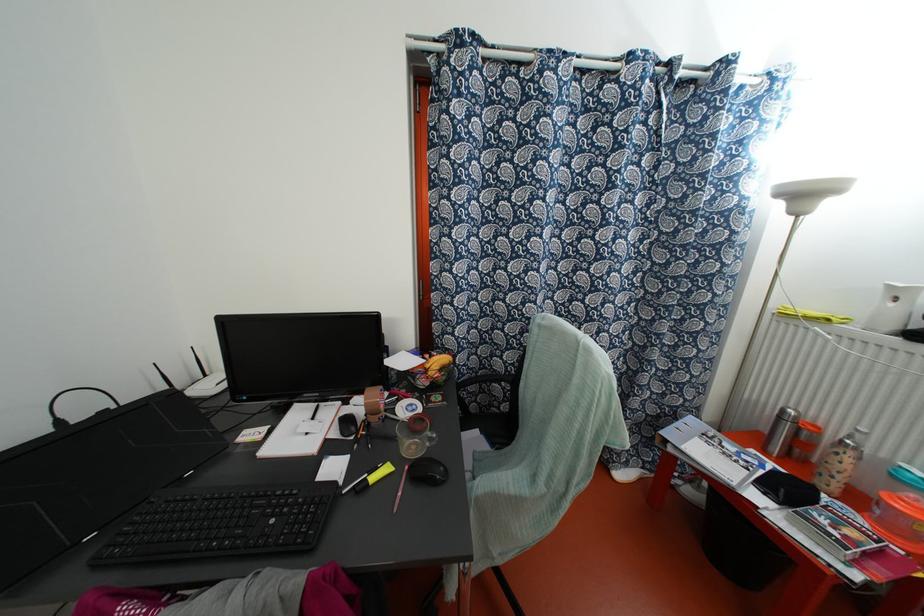
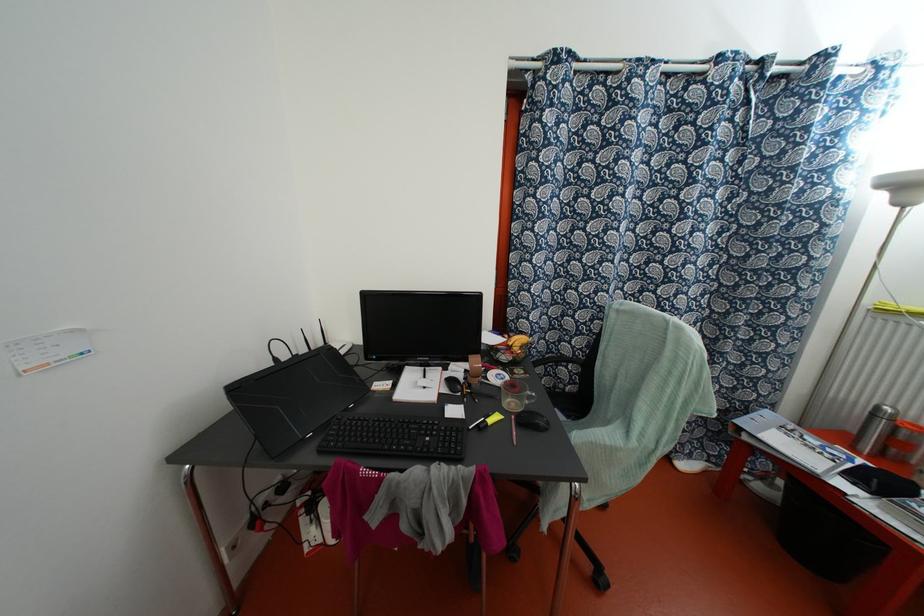
The point at [442,482] is marked in the first image. Where is the corresponding point in the second image?

(545, 429)